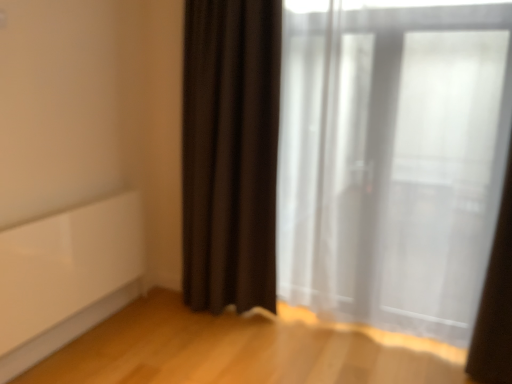
Question: Does point (437, 231) appear closer or farther from the camera than point (499, 374)?

Choices:
 (A) closer
 (B) farther

Answer: (B)

Question: Is white sheer curtain at right, which is the 1th curtain from left to right, inside the boundaries of white sheer curtain at right, the 1th curtain positioned from the right, or outside?

Choices:
 (A) outside
 (B) inside

Answer: (A)

Question: Relative to white sheer curtain at right, the 1th curtain positioned from the right, is white sheer curtain at right, which is the 1th curtain from left to right, in front or behind?

Choices:
 (A) behind
 (B) front

Answer: (A)

Question: In the image, is white sheer curtain at right, the 1th curtain positioned from the right, positioned in front of or behind white sheer curtain at right, which is the 1th curtain from left to right?

Choices:
 (A) behind
 (B) front

Answer: (B)

Question: Is point (505, 340) positioned closer to the camera than point (356, 134)?

Choices:
 (A) closer
 (B) farther

Answer: (A)

Question: Based on their sizes in the image, would you say white sheer curtain at right, which is the second curtain in left-to-right order, is bigger or smaller than white sheer curtain at right, acting as the second curtain starting from the right?

Choices:
 (A) big
 (B) small

Answer: (B)

Question: Considering the positions of white sheer curtain at right, which is the second curtain in left-to-right order, and white sheer curtain at right, acting as the second curtain starting from the right, in the image, is white sheer curtain at right, which is the second curtain in left-to-right order, taller or shorter than white sheer curtain at right, acting as the second curtain starting from the right,?

Choices:
 (A) tall
 (B) short

Answer: (B)